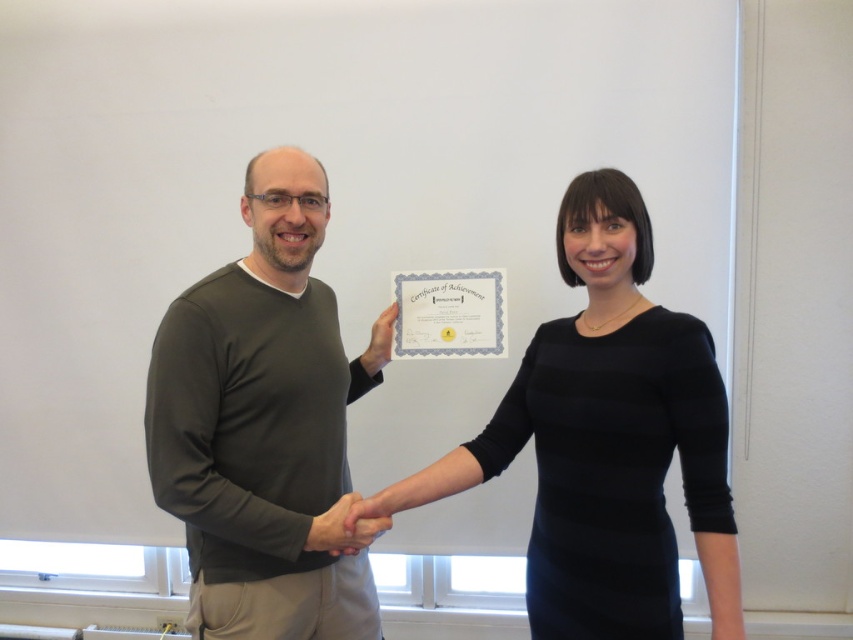
You are standing in the room where the handshake is taking place. There are two points marked in the image. The first point is at coordinate point (331, 360) and the second point is at coordinate point (605, 236). If you were to walk towards both points, which point would you reach first?

Point (331, 360) is closer to you than point (605, 236), so you would reach point (331, 360) first.

You are a photographer setting up for a group photo. You see the dark green sweater at center and the black matte dress at center in the frame. Which clothing item should you adjust to ensure both are fully visible in the photo?

The dark green sweater at center is much taller than the black matte dress at center, so you should adjust the dark green sweater at center to ensure it fits within the frame.